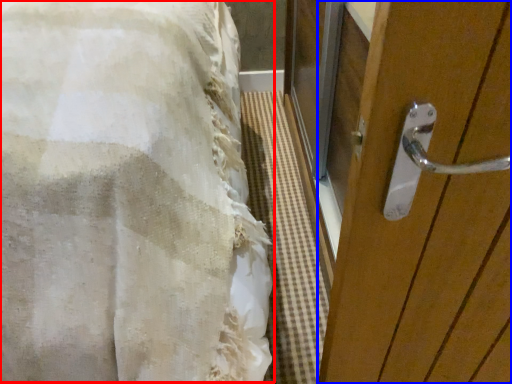
Question: Which object appears closest to the camera in this image, bed (highlighted by a red box) or door (highlighted by a blue box)?

Choices:
 (A) bed
 (B) door

Answer: (A)